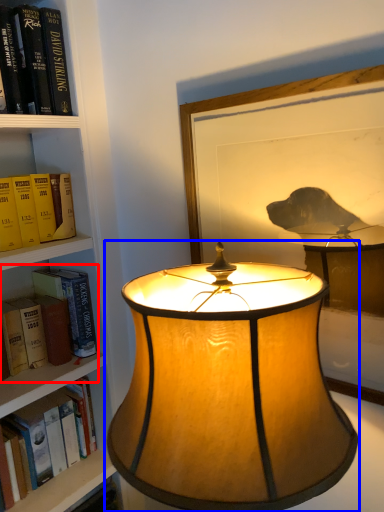
Question: Which object appears farthest to the camera in this image, book (highlighted by a red box) or lamp (highlighted by a blue box)?

Choices:
 (A) book
 (B) lamp

Answer: (A)